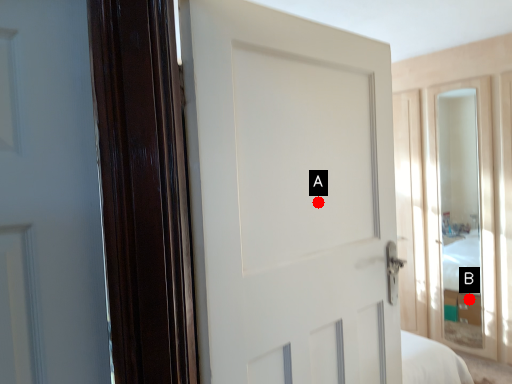
Question: Two points are circled on the image, labeled by A and B beside each circle. Which point is closer to the camera?

Choices:
 (A) A is closer
 (B) B is closer

Answer: (A)